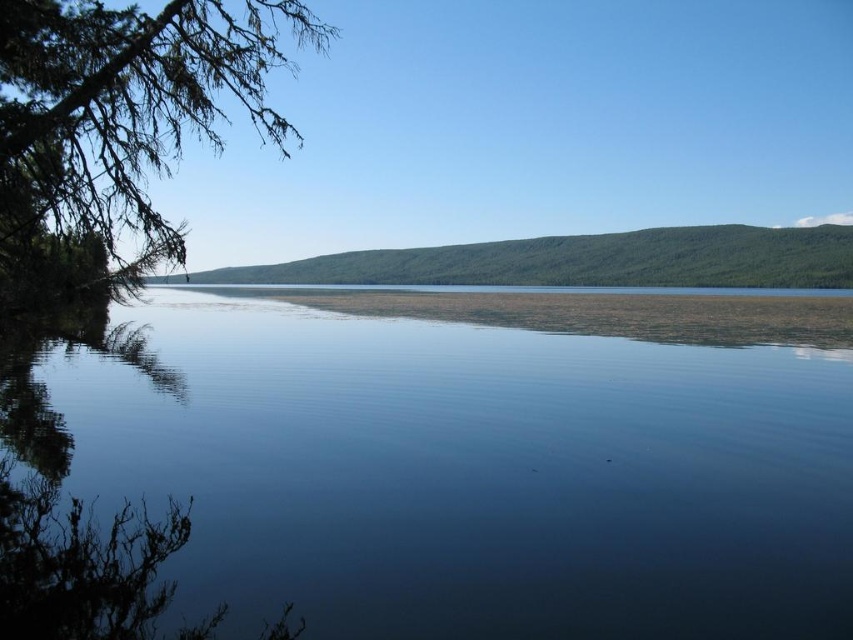
Question: Does deep blue water at center appear over green leafy branch at upper left?

Choices:
 (A) yes
 (B) no

Answer: (B)

Question: Is deep blue water at center above green leafy branch at upper left?

Choices:
 (A) no
 (B) yes

Answer: (A)

Question: Among these objects, which one is farthest from the camera?

Choices:
 (A) deep blue water at center
 (B) green leafy branch at upper left

Answer: (B)

Question: Among these points, which one is farthest from the camera?

Choices:
 (A) (187, 131)
 (B) (727, 404)

Answer: (B)

Question: Is deep blue water at center wider than green leafy branch at upper left?

Choices:
 (A) no
 (B) yes

Answer: (B)